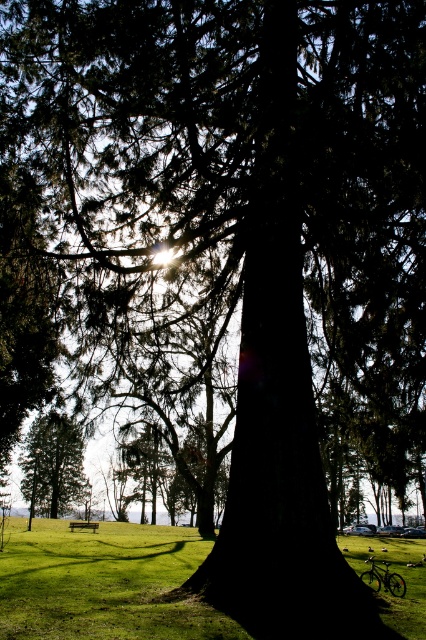
Question: Does green grass at center appear on the left side of green matte tree at center?

Choices:
 (A) yes
 (B) no

Answer: (B)

Question: Does green grass at center appear over green matte tree at center?

Choices:
 (A) yes
 (B) no

Answer: (B)

Question: Which of these objects is positioned closest to the green matte tree at center?

Choices:
 (A) green grass at center
 (B) wooden bench at lower center

Answer: (B)

Question: Is green grass at center smaller than green matte tree at center?

Choices:
 (A) yes
 (B) no

Answer: (B)

Question: Among these objects, which one is nearest to the camera?

Choices:
 (A) green grass at center
 (B) wooden bench at lower center
 (C) green matte tree at center

Answer: (A)

Question: Which of these objects is positioned closest to the green grass at center?

Choices:
 (A) green matte tree at center
 (B) wooden bench at lower center

Answer: (A)